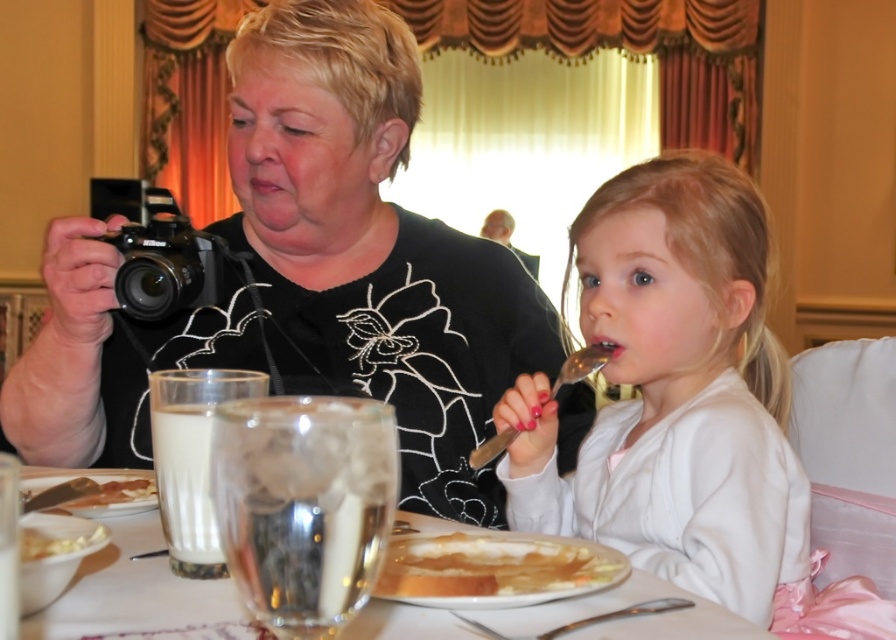
Is point (289, 228) closer to viewer compared to point (501, 440)?

No, it is behind (501, 440).

This screenshot has height=640, width=896. Describe the element at coordinates (304, 275) in the screenshot. I see `black matte camera at upper left` at that location.

The image size is (896, 640). I want to click on black matte camera at upper left, so click(x=304, y=275).

Is black plastic camera at left above metallic silver spoon at upper center?

Correct, black plastic camera at left is located above metallic silver spoon at upper center.

Does black plastic camera at left lie in front of metallic silver spoon at upper center?

No.

Describe the element at coordinates (158, 252) in the screenshot. The image size is (896, 640). I see `black plastic camera at left` at that location.

Locate an element on the screen. This screenshot has height=640, width=896. black plastic camera at left is located at coordinates click(158, 252).

Does point (755, 291) come behind point (197, 244)?

Yes, it is.

Consider the image. Which is above, smooth white shirt at center or black plastic camera at left?

black plastic camera at left is higher up.

Measure the distance between smooth white shirt at center and camera.

The distance of smooth white shirt at center from camera is 38.30 inches.

The height and width of the screenshot is (640, 896). What are the coordinates of `smooth white shirt at center` in the screenshot? It's located at tap(674, 392).